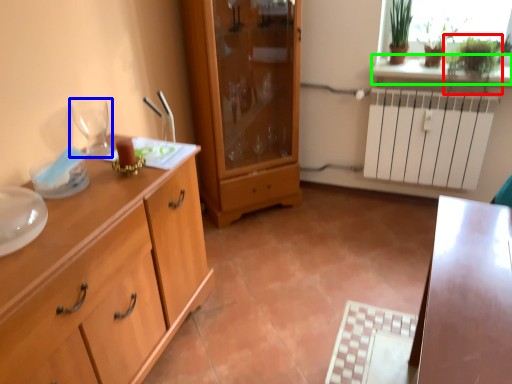
Question: Based on their relative distances, which object is farther from plant (highlighted by a red box)? Choose from wine glass (highlighted by a blue box) and window sill (highlighted by a green box).

Choices:
 (A) wine glass
 (B) window sill

Answer: (A)